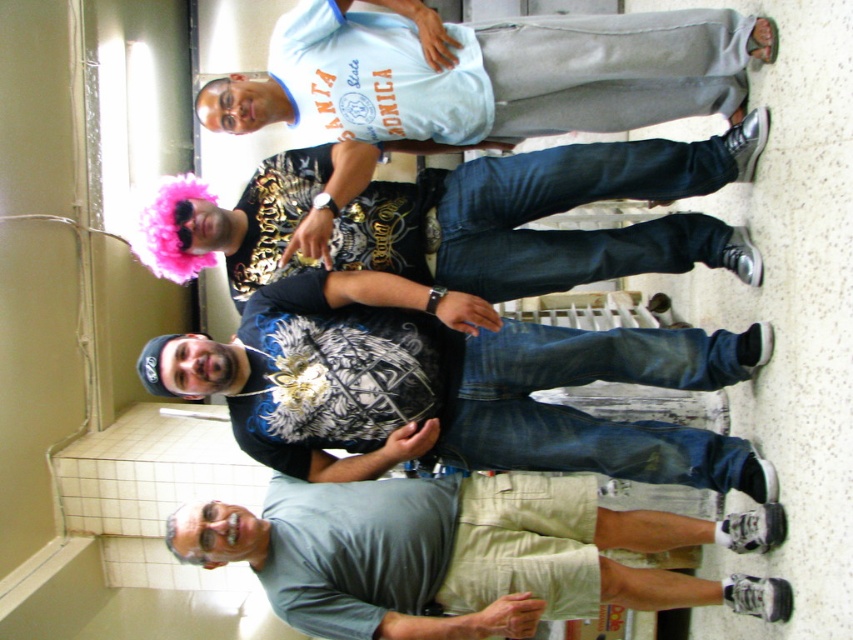
Question: Which point is closer to the camera?

Choices:
 (A) pink fluffy wig at upper left
 (B) black matte t-shirt at center

Answer: (B)

Question: From the image, what is the correct spatial relationship of gray cotton t-shirt at lower center in relation to pink fluffy wig at upper left?

Choices:
 (A) right
 (B) left

Answer: (A)

Question: Among these objects, which one is farthest from the camera?

Choices:
 (A) gray cotton t-shirt at lower center
 (B) black matte t-shirt at center

Answer: (B)

Question: Does pink fluffy wig at upper left have a larger size compared to light blue cotton shirt at center?

Choices:
 (A) yes
 (B) no

Answer: (A)

Question: Which object is closer to the camera taking this photo?

Choices:
 (A) pink fluffy wig at upper left
 (B) light blue cotton shirt at center
 (C) gray cotton t-shirt at lower center

Answer: (C)

Question: Can you confirm if pink fluffy wig at upper left is wider than light blue cotton shirt at center?

Choices:
 (A) yes
 (B) no

Answer: (A)